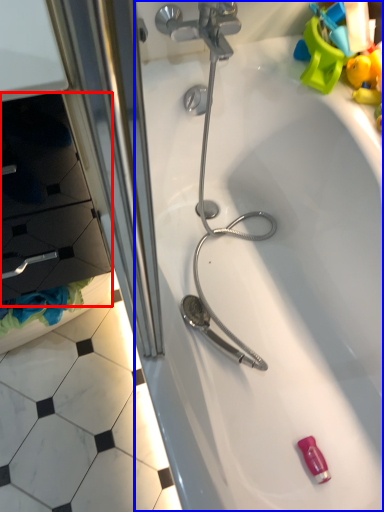
Question: Which object is further to the camera taking this photo, drawer (highlighted by a red box) or bathtub (highlighted by a blue box)?

Choices:
 (A) drawer
 (B) bathtub

Answer: (B)